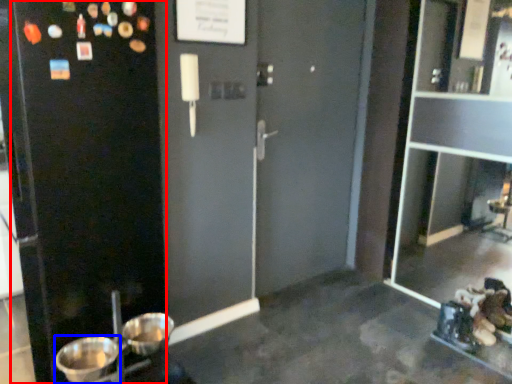
Question: Which object appears farthest to the camera in this image, screen door (highlighted by a red box) or basin (highlighted by a blue box)?

Choices:
 (A) screen door
 (B) basin

Answer: (B)